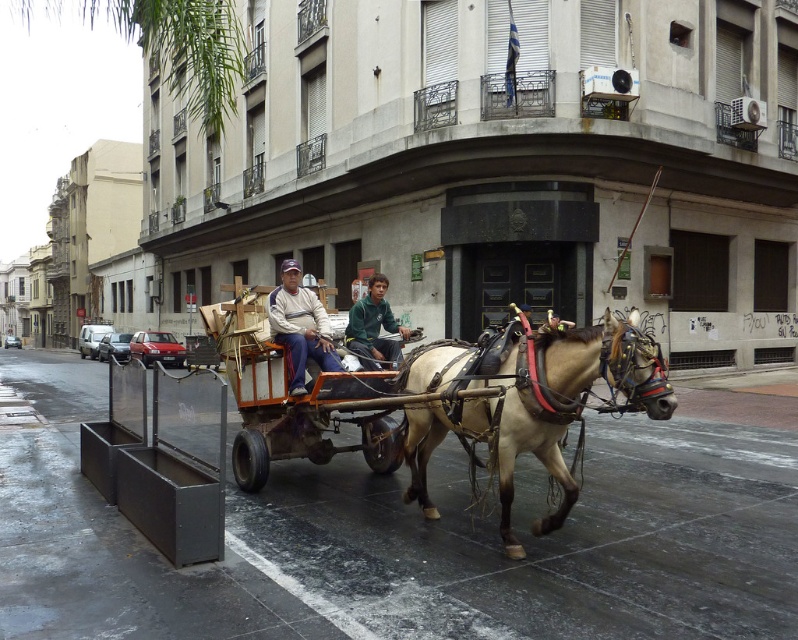
You are a photographer trying to capture both the light brown leather horse at center and the light brown leather jacket at center in a single frame. Since the horse is larger, will you need to adjust your camera angle to ensure both are fully visible?

The light brown leather horse at center is larger in size than the light brown leather jacket at center, so you will need to adjust your camera angle to ensure both are fully visible in the frame.

You are a delivery person standing next to the light brown leather horse at center and the green fuzzy jacket at center. You need to attach a harness extension to the wider object. Which object should you choose?

The light brown leather horse at center is wider than the green fuzzy jacket at center, so you should attach the harness extension to the light brown leather horse at center.